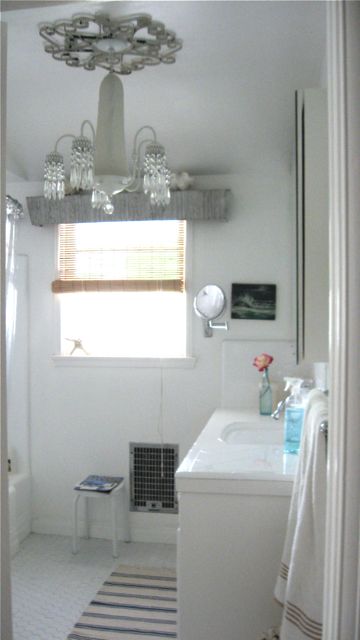
Identify the location of towel. (301, 543).